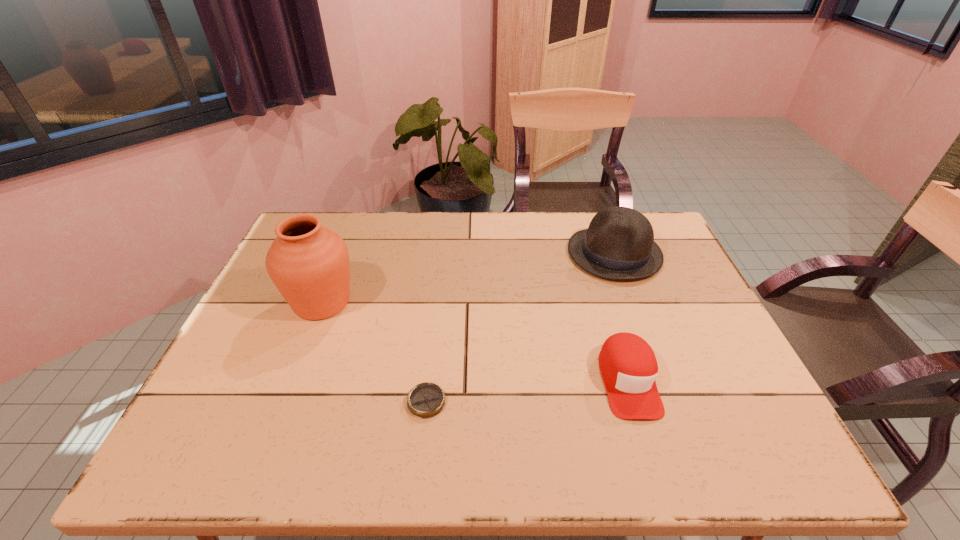
Where is `vacant space that's between the third object from right to left and the leftmost object`? This screenshot has width=960, height=540. vacant space that's between the third object from right to left and the leftmost object is located at coordinates (374, 352).

You are a GUI agent. You are given a task and a screenshot of the screen. Output one action in this format:
    pyautogui.click(x=<x>, y=<y>)
    Task: Click on the object that is the second closest one to the tallest object
    Image resolution: width=960 pixels, height=540 pixels.
    Given the screenshot: What is the action you would take?
    pyautogui.click(x=619, y=244)

The height and width of the screenshot is (540, 960). What are the coordinates of `object that ranks as the second closest to the shortest object` in the screenshot? It's located at (628, 366).

In order to click on free space that satisfies the following two spatial constraints: 1. on the front-facing side of the bowler hat; 2. on the front-facing side of the baseball cap in this screenshot , I will do `click(661, 380)`.

The width and height of the screenshot is (960, 540). Find the location of `free space that satisfies the following two spatial constraints: 1. on the front-facing side of the bowler hat; 2. on the front-facing side of the third tallest object`. free space that satisfies the following two spatial constraints: 1. on the front-facing side of the bowler hat; 2. on the front-facing side of the third tallest object is located at coordinates (661, 380).

At what (x,y) coordinates should I click in order to perform the action: click on blank space that satisfies the following two spatial constraints: 1. on the front-facing side of the bowler hat; 2. on the front-facing side of the second shortest object. Please return your answer as a coordinate pair (x, y). The image size is (960, 540). Looking at the image, I should click on (661, 380).